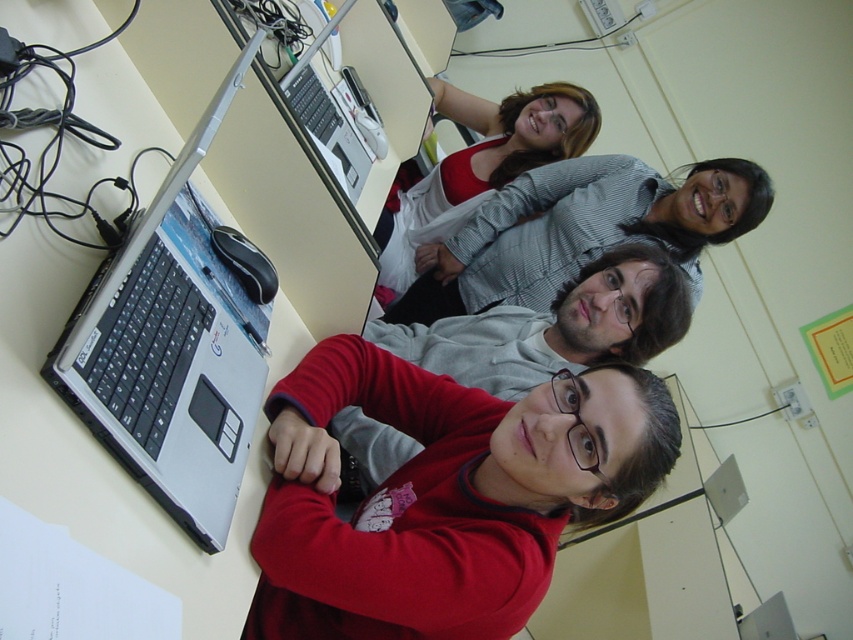
Question: Which point is closer to the camera?

Choices:
 (A) (689, 218)
 (B) (440, 198)
 (C) (108, 284)

Answer: (C)

Question: Can you confirm if silver/black plastic laptop at lower left is thinner than striped shirt at center?

Choices:
 (A) no
 (B) yes

Answer: (B)

Question: Can you confirm if striped shirt at center is thinner than matte gray sweater at center?

Choices:
 (A) yes
 (B) no

Answer: (B)

Question: Which object is farther from the camera taking this photo?

Choices:
 (A) silver/black plastic laptop at lower left
 (B) striped shirt at center
 (C) matte gray sweater at center

Answer: (C)

Question: Where is silver/black plastic laptop at lower left located in relation to striped shirt at center in the image?

Choices:
 (A) above
 (B) below

Answer: (B)

Question: Among these points, which one is nearest to the camera?

Choices:
 (A) (207, 336)
 (B) (537, 156)
 (C) (561, 212)

Answer: (A)